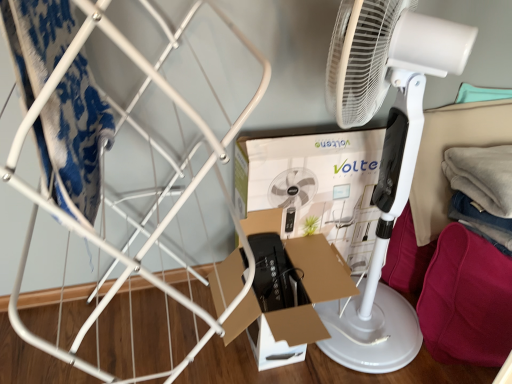
What do you see at coordinates (386, 153) in the screenshot?
I see `white plastic mechanical fan at center` at bounding box center [386, 153].

Where is `white plastic mechanical fan at center`? white plastic mechanical fan at center is located at coordinates (386, 153).

Find the location of a particular element. Image resolution: width=512 pixels, height=384 pixels. cardboard box at center is located at coordinates (287, 292).

What do you see at coordinates (314, 183) in the screenshot? I see `white cardboard box at center` at bounding box center [314, 183].

Locate an element on the screen. white plastic mechanical fan at center is located at coordinates (386, 153).

Is point (265, 171) behind point (376, 274)?

No, (265, 171) is in front of (376, 274).

Is white cardboard box at center oriented towards white plastic mechanical fan at center?

Yes, white cardboard box at center is facing white plastic mechanical fan at center.

Locate an element on the screen. The image size is (512, 384). mechanical fan above the white cardboard box at center (from the image's perspective) is located at coordinates (386, 153).

From the image's perspective, is white cardboard box at center positioned above or below cardboard box at center?

Based on their image positions, white cardboard box at center is located above cardboard box at center.

From a real-world perspective, which is physically above, white cardboard box at center or cardboard box at center?

white cardboard box at center, from a real-world perspective.

Locate an element on the screen. The width and height of the screenshot is (512, 384). cardboard box located in front of the white cardboard box at center is located at coordinates (287, 292).

Looking at the image, does burgundy fabric cushion at lower right seem bigger or smaller compared to cardboard box at center?

In the image, burgundy fabric cushion at lower right appears to be smaller than cardboard box at center.

From the image's perspective, is burgundy fabric cushion at lower right located beneath cardboard box at center?

Incorrect, from the image's perspective, burgundy fabric cushion at lower right is higher than cardboard box at center.

Between burgundy fabric cushion at lower right and cardboard box at center, which one has less height?

cardboard box at center.

Looking at this image, which is farther from the camera, (482, 285) or (298, 246)?

Point (298, 246)

Where is `mechanical fan above the cardboard box at center (from the image's perspective)`? Image resolution: width=512 pixels, height=384 pixels. mechanical fan above the cardboard box at center (from the image's perspective) is located at coordinates (386, 153).

From a real-world perspective, is white plastic mechanical fan at center beneath cardboard box at center?

No, from a real-world perspective, white plastic mechanical fan at center is not below cardboard box at center.

Which object is wider, white plastic mechanical fan at center or cardboard box at center?

Wider between the two is white plastic mechanical fan at center.

Is cardboard box at center surrounded by white plastic mechanical fan at center?

Yes, cardboard box at center is surrounded by white plastic mechanical fan at center.

Can you confirm if white plastic mechanical fan at center is taller than white cardboard box at center?

Indeed, white plastic mechanical fan at center has a greater height compared to white cardboard box at center.

Identify the location of mechanical fan above the white cardboard box at center (from the image's perspective). The image size is (512, 384). pos(386,153).

Can you confirm if white plastic mechanical fan at center is smaller than white cardboard box at center?

Incorrect, white plastic mechanical fan at center is not smaller in size than white cardboard box at center.

At what (x,y) coordinates should I click in order to perform the action: click on mechanical fan in front of the burgundy fabric cushion at lower right. Please return your answer as a coordinate pair (x, y). Looking at the image, I should click on pos(386,153).

Can you confirm if white plastic mechanical fan at center is bigger than burgundy fabric cushion at lower right?

Yes, white plastic mechanical fan at center is bigger than burgundy fabric cushion at lower right.

From a real-world perspective, which is physically below, white plastic mechanical fan at center or burgundy fabric cushion at lower right?

burgundy fabric cushion at lower right is physically lower.

Is burgundy fabric cushion at lower right at the left side of white plastic mechanical fan at center?

Incorrect, burgundy fabric cushion at lower right is not on the left side of white plastic mechanical fan at center.

From the image's perspective, is burgundy fabric cushion at lower right located beneath white plastic mechanical fan at center?

Yes.

Considering the relative sizes of burgundy fabric cushion at lower right and white plastic mechanical fan at center in the image provided, is burgundy fabric cushion at lower right smaller than white plastic mechanical fan at center?

Indeed, burgundy fabric cushion at lower right has a smaller size compared to white plastic mechanical fan at center.

Who is more distant, burgundy fabric cushion at lower right or white plastic mechanical fan at center?

Positioned behind is burgundy fabric cushion at lower right.

Find the location of `mechanical fan on the right of white cardboard box at center`. mechanical fan on the right of white cardboard box at center is located at coordinates (386, 153).

This screenshot has height=384, width=512. Find the location of `cardboard box lying in front of the white cardboard box at center`. cardboard box lying in front of the white cardboard box at center is located at coordinates (287, 292).

Estimate the real-world distances between objects in this image. Which object is closer to white plastic mechanical fan at center, white cardboard box at center or burgundy fabric cushion at lower right?

The object closer to white plastic mechanical fan at center is white cardboard box at center.

Looking at the image, which one is located further to burgundy fabric cushion at lower right, white cardboard box at center or cardboard box at center?

Based on the image, cardboard box at center appears to be further to burgundy fabric cushion at lower right.

From the image, which object appears to be farther from white plastic mechanical fan at center, cardboard box at center or white cardboard box at center?

Based on the image, cardboard box at center appears to be further to white plastic mechanical fan at center.

Looking at the image, which one is located further to cardboard box at center, burgundy fabric cushion at lower right or white cardboard box at center?

The object further to cardboard box at center is burgundy fabric cushion at lower right.

Considering their positions, is white cardboard box at center positioned closer to cardboard box at center than white plastic mechanical fan at center?

Based on the image, white cardboard box at center appears to be nearer to cardboard box at center.

When comparing their distances from white plastic mechanical fan at center, does white cardboard box at center or cardboard box at center seem closer?

white cardboard box at center.

From the image, which object appears to be nearer to white plastic mechanical fan at center, cardboard box at center or burgundy fabric cushion at lower right?

Among the two, burgundy fabric cushion at lower right is located nearer to white plastic mechanical fan at center.

Estimate the real-world distances between objects in this image. Which object is further from white plastic mechanical fan at center, burgundy fabric cushion at lower right or cardboard box at center?

cardboard box at center lies further to white plastic mechanical fan at center than the other object.

Locate an element on the screen. box situated between cardboard box at center and burgundy fabric cushion at lower right from left to right is located at coordinates (314, 183).

The height and width of the screenshot is (384, 512). I want to click on mechanical fan between white cardboard box at center and burgundy fabric cushion at lower right in the horizontal direction, so click(x=386, y=153).

Find the location of a particular element. The image size is (512, 384). cardboard box between white plastic mechanical fan at center and white cardboard box at center from front to back is located at coordinates (287, 292).

Locate an element on the screen. Image resolution: width=512 pixels, height=384 pixels. mechanical fan between cardboard box at center and burgundy fabric cushion at lower right is located at coordinates [386, 153].